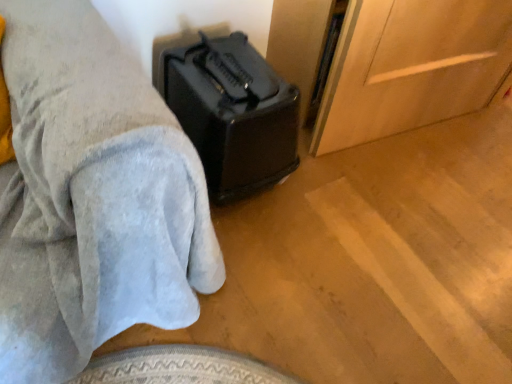
Question: Does black plastic speaker at lower left contain black plastic suitcase at center?

Choices:
 (A) no
 (B) yes

Answer: (A)

Question: Is black plastic speaker at lower left outside black plastic suitcase at center?

Choices:
 (A) no
 (B) yes

Answer: (B)

Question: Does black plastic speaker at lower left have a lesser height compared to black plastic suitcase at center?

Choices:
 (A) no
 (B) yes

Answer: (A)

Question: From the image's perspective, is black plastic speaker at lower left beneath black plastic suitcase at center?

Choices:
 (A) yes
 (B) no

Answer: (A)

Question: From a real-world perspective, is black plastic speaker at lower left beneath black plastic suitcase at center?

Choices:
 (A) no
 (B) yes

Answer: (A)

Question: Considering the relative sizes of black plastic speaker at lower left and black plastic suitcase at center in the image provided, is black plastic speaker at lower left thinner than black plastic suitcase at center?

Choices:
 (A) no
 (B) yes

Answer: (A)

Question: Does black plastic suitcase at center have a lesser width compared to black plastic speaker at lower left?

Choices:
 (A) yes
 (B) no

Answer: (A)

Question: From the image's perspective, would you say black plastic suitcase at center is positioned over black plastic speaker at lower left?

Choices:
 (A) no
 (B) yes

Answer: (B)

Question: From the image's perspective, is black plastic suitcase at center beneath black plastic speaker at lower left?

Choices:
 (A) yes
 (B) no

Answer: (B)

Question: From a real-world perspective, is black plastic suitcase at center beneath black plastic speaker at lower left?

Choices:
 (A) yes
 (B) no

Answer: (A)

Question: Is black plastic suitcase at center wider than black plastic speaker at lower left?

Choices:
 (A) no
 (B) yes

Answer: (A)

Question: Does black plastic suitcase at center turn towards black plastic speaker at lower left?

Choices:
 (A) yes
 (B) no

Answer: (B)

Question: From the image's perspective, relative to black plastic speaker at lower left, is black plastic suitcase at center above or below?

Choices:
 (A) above
 (B) below

Answer: (A)